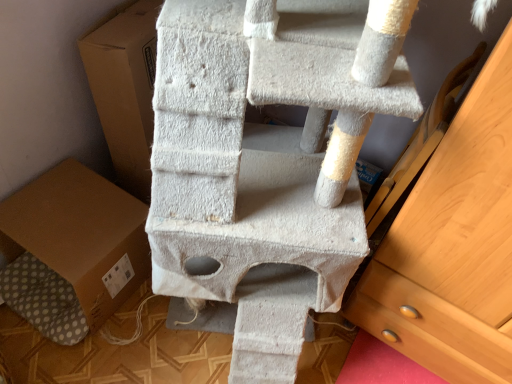
Question: Is brown cardboard box at lower left oriented towards wooden chest of drawers at right?

Choices:
 (A) no
 (B) yes

Answer: (A)

Question: Considering the relative sizes of brown cardboard box at lower left and wooden chest of drawers at right in the image provided, is brown cardboard box at lower left smaller than wooden chest of drawers at right?

Choices:
 (A) no
 (B) yes

Answer: (A)

Question: From a real-world perspective, is brown cardboard box at lower left on top of wooden chest of drawers at right?

Choices:
 (A) yes
 (B) no

Answer: (B)

Question: Considering the relative positions of brown cardboard box at lower left and wooden chest of drawers at right in the image provided, is brown cardboard box at lower left in front of wooden chest of drawers at right?

Choices:
 (A) no
 (B) yes

Answer: (A)

Question: From a real-world perspective, is brown cardboard box at lower left under wooden chest of drawers at right?

Choices:
 (A) yes
 (B) no

Answer: (A)

Question: Are brown cardboard box at lower left and wooden chest of drawers at right located far from each other?

Choices:
 (A) no
 (B) yes

Answer: (A)

Question: Does wooden chest of drawers at right have a lesser height compared to brown cardboard box at lower left?

Choices:
 (A) no
 (B) yes

Answer: (A)

Question: Is wooden chest of drawers at right thinner than brown cardboard box at lower left?

Choices:
 (A) no
 (B) yes

Answer: (B)

Question: From a real-world perspective, does wooden chest of drawers at right sit lower than brown cardboard box at lower left?

Choices:
 (A) no
 (B) yes

Answer: (A)

Question: Is wooden chest of drawers at right further to camera compared to brown cardboard box at lower left?

Choices:
 (A) yes
 (B) no

Answer: (B)

Question: Is wooden chest of drawers at right facing towards brown cardboard box at lower left?

Choices:
 (A) yes
 (B) no

Answer: (B)

Question: From the image's perspective, is wooden chest of drawers at right below brown cardboard box at lower left?

Choices:
 (A) yes
 (B) no

Answer: (B)

Question: Is wooden chest of drawers at right bigger or smaller than brown cardboard box at lower left?

Choices:
 (A) big
 (B) small

Answer: (B)